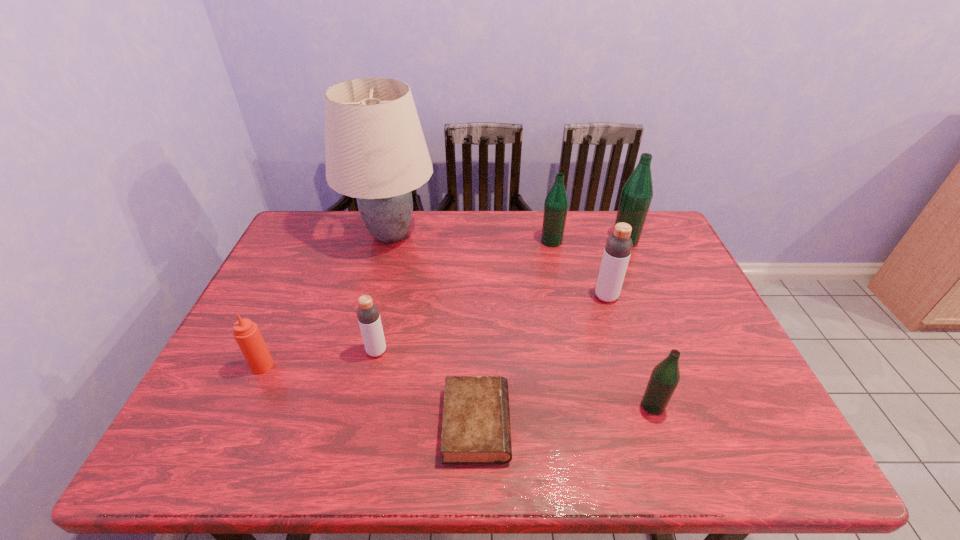
I want to click on free region at the left edge of the desktop, so click(x=216, y=418).

Where is `vacant space at the right edge of the desktop`? vacant space at the right edge of the desktop is located at coordinates (661, 310).

This screenshot has width=960, height=540. I want to click on free space at the near left corner, so click(x=225, y=434).

Locate an element on the screen. This screenshot has height=540, width=960. vacant region at the far right corner is located at coordinates (655, 229).

You are a GUI agent. You are given a task and a screenshot of the screen. Output one action in this format:
    pyautogui.click(x=<x>, y=<y>)
    Task: Click on the free spot between the fifth nearest object and the second biggest green bottle
    The image size is (960, 540).
    Given the screenshot: What is the action you would take?
    pyautogui.click(x=579, y=269)

This screenshot has width=960, height=540. In order to click on empty space between the leftmost bottle and the second green bottle from left to right in this screenshot , I will do `click(515, 378)`.

Locate an element on the screen. The height and width of the screenshot is (540, 960). free space between the nearest green bottle and the leftmost bottle is located at coordinates (515, 378).

I want to click on free area in between the Tabasco sauce and the leftmost bottle, so click(x=320, y=359).

Find the location of a particular element. Image resolution: width=960 pixels, height=540 pixels. free spot between the Tabasco sauce and the smaller gray bottle is located at coordinates (320, 359).

Locate an element on the screen. Image resolution: width=960 pixels, height=540 pixels. unoccupied position between the rightmost bottle and the Tabasco sauce is located at coordinates (444, 303).